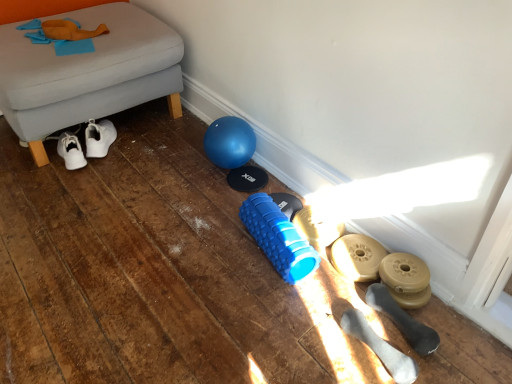
Image resolution: width=512 pixels, height=384 pixels. Describe the element at coordinates (317, 227) in the screenshot. I see `blue rubber shoe at center, placed as the 1th footwear when sorted from back to front` at that location.

The image size is (512, 384). Describe the element at coordinates (380, 347) in the screenshot. I see `white rubber dumbbells at lower right, the 1th footwear in the front-to-back sequence` at that location.

Identify the location of black rubber dumbbell at lower right, which is the second footwear in front-to-back order. Image resolution: width=512 pixels, height=384 pixels. (403, 320).

Identify the location of matte gold dumbbell at lower right, which appears as the third footwear when viewed from the back. This screenshot has width=512, height=384. (406, 279).

From their relative heights in the image, would you say beige rubber weight at lower right, which is the fourth footwear from front to back, is taller or shorter than blue rubber foam roller at center?

In the image, beige rubber weight at lower right, which is the fourth footwear from front to back, appears to be shorter than blue rubber foam roller at center.

From a real-world perspective, is beige rubber weight at lower right, the 2th footwear in the back-to-front sequence, physically above blue rubber foam roller at center?

Incorrect, from a real-world perspective, beige rubber weight at lower right, the 2th footwear in the back-to-front sequence, is lower than blue rubber foam roller at center.

From the image's perspective, is beige rubber weight at lower right, which is the fourth footwear from front to back, located above blue rubber foam roller at center?

Actually, beige rubber weight at lower right, which is the fourth footwear from front to back, appears below blue rubber foam roller at center in the image.

At what (x,y) coordinates should I click in order to perform the action: click on the 1st footwear behind the blue rubber foam roller at center, counting from the anchor's position. Please return your answer as a coordinate pair (x, y). The width and height of the screenshot is (512, 384). Looking at the image, I should click on (357, 257).

From the image's perspective, which is above, blue rubber foam roller at center or black rubber dumbbell at lower right, which is the second footwear in front-to-back order?

blue rubber foam roller at center appears higher in the image.

Is black rubber dumbbell at lower right, which is the second footwear in front-to-back order, inside blue rubber foam roller at center?

No, black rubber dumbbell at lower right, which is the second footwear in front-to-back order, is not inside blue rubber foam roller at center.

At what (x,y) coordinates should I click in order to perform the action: click on dumbbell lying behind the black rubber dumbbell at lower right, which is counted as the 4th footwear, starting from the back. Please return your answer as a coordinate pair (x, y). This screenshot has width=512, height=384. Looking at the image, I should click on (278, 238).

How different are the orientations of blue rubber foam roller at center and black rubber dumbbell at lower right, which is counted as the 4th footwear, starting from the back, in degrees?

blue rubber foam roller at center and black rubber dumbbell at lower right, which is counted as the 4th footwear, starting from the back, are facing 5.18 degrees away from each other.

Is gray fabric ottoman at lower left to the left or to the right of white rubber dumbbells at lower right, which is the 5th footwear from back to front, in the image?

Clearly, gray fabric ottoman at lower left is on the left of white rubber dumbbells at lower right, which is the 5th footwear from back to front, in the image.

Between gray fabric ottoman at lower left and white rubber dumbbells at lower right, the 1th footwear in the front-to-back sequence, which one is positioned in front?

white rubber dumbbells at lower right, the 1th footwear in the front-to-back sequence, is in front.

Would you say gray fabric ottoman at lower left is a long distance from white rubber dumbbells at lower right, which is the 5th footwear from back to front?

Yes, gray fabric ottoman at lower left is far from white rubber dumbbells at lower right, which is the 5th footwear from back to front.

Looking at this image, from a real-world perspective, is gray fabric ottoman at lower left located higher than white rubber dumbbells at lower right, the 1th footwear in the front-to-back sequence?

Indeed, from a real-world perspective, gray fabric ottoman at lower left stands above white rubber dumbbells at lower right, the 1th footwear in the front-to-back sequence.

Is point (28, 138) more distant than point (426, 299)?

Yes, point (28, 138) is behind point (426, 299).

Considering the positions of objects gray fabric ottoman at lower left and matte gold dumbbell at lower right, which appears as the third footwear when viewed from the back, in the image provided, who is in front, gray fabric ottoman at lower left or matte gold dumbbell at lower right, which appears as the third footwear when viewed from the back,?

matte gold dumbbell at lower right, which appears as the third footwear when viewed from the back, is closer to the camera.

Considering the relative sizes of gray fabric ottoman at lower left and matte gold dumbbell at lower right, positioned as the third footwear in front-to-back order, in the image provided, is gray fabric ottoman at lower left wider than matte gold dumbbell at lower right, positioned as the third footwear in front-to-back order,?

Correct, the width of gray fabric ottoman at lower left exceeds that of matte gold dumbbell at lower right, positioned as the third footwear in front-to-back order.

From the picture: Does gray fabric ottoman at lower left have a greater width compared to black rubber dumbbell at lower right, which is the second footwear in front-to-back order?

Yes, gray fabric ottoman at lower left is wider than black rubber dumbbell at lower right, which is the second footwear in front-to-back order.

Could you tell me if gray fabric ottoman at lower left is facing black rubber dumbbell at lower right, which is counted as the 4th footwear, starting from the back?

Yes, gray fabric ottoman at lower left is oriented towards black rubber dumbbell at lower right, which is counted as the 4th footwear, starting from the back.

Is point (102, 86) behind point (396, 324)?

Yes.

Is blue rubber shoe at center, the fifth footwear positioned from the front, looking in the opposite direction of blue rubber foam roller at center?

That's not correct — blue rubber shoe at center, the fifth footwear positioned from the front, is not looking away from blue rubber foam roller at center.

Can you confirm if blue rubber shoe at center, the fifth footwear positioned from the front, is thinner than blue rubber foam roller at center?

No, blue rubber shoe at center, the fifth footwear positioned from the front, is not thinner than blue rubber foam roller at center.

From a real-world perspective, which object rests below the other?

blue rubber shoe at center, the fifth footwear positioned from the front, is physically lower.

From a real-world perspective, relative to white rubber dumbbells at lower right, the 1th footwear in the front-to-back sequence, is blue rubber foam roller at center vertically above or below?

blue rubber foam roller at center is above white rubber dumbbells at lower right, the 1th footwear in the front-to-back sequence.

What's the angular difference between blue rubber foam roller at center and white rubber dumbbells at lower right, the 1th footwear in the front-to-back sequence,'s facing directions?

The facing directions of blue rubber foam roller at center and white rubber dumbbells at lower right, the 1th footwear in the front-to-back sequence, are 2.79 degrees apart.

Do you think blue rubber foam roller at center is within white rubber dumbbells at lower right, the 1th footwear in the front-to-back sequence, or outside of it?

blue rubber foam roller at center is located beyond the bounds of white rubber dumbbells at lower right, the 1th footwear in the front-to-back sequence.

At what (x,y) coordinates should I click in order to perform the action: click on dumbbell on the left of beige rubber weight at lower right, the 2th footwear in the back-to-front sequence. Please return your answer as a coordinate pair (x, y). Image resolution: width=512 pixels, height=384 pixels. Looking at the image, I should click on (278, 238).

Identify the location of the 4th footwear counting from the right side of the blue rubber foam roller at center. Image resolution: width=512 pixels, height=384 pixels. (403, 320).

Looking at the image, which one is located further to gray fabric ottoman at lower left, blue rubber foam roller at center or blue rubber shoe at center, placed as the 1th footwear when sorted from back to front?

blue rubber shoe at center, placed as the 1th footwear when sorted from back to front.

Estimate the real-world distances between objects in this image. Which object is further from matte gold dumbbell at lower right, which appears as the third footwear when viewed from the back, black rubber dumbbell at lower right, which is the second footwear in front-to-back order, or gray fabric ottoman at lower left?

gray fabric ottoman at lower left.

Looking at this image, which object lies nearer to the anchor point blue rubber foam roller at center, beige rubber weight at lower right, the 2th footwear in the back-to-front sequence, or blue rubber shoe at center, the fifth footwear positioned from the front?

Based on the image, blue rubber shoe at center, the fifth footwear positioned from the front, appears to be nearer to blue rubber foam roller at center.

From the image, which object appears to be farther from blue rubber shoe at center, placed as the 1th footwear when sorted from back to front, beige rubber weight at lower right, the 2th footwear in the back-to-front sequence, or white rubber dumbbells at lower right, the 1th footwear in the front-to-back sequence?

Among the two, white rubber dumbbells at lower right, the 1th footwear in the front-to-back sequence, is located further to blue rubber shoe at center, placed as the 1th footwear when sorted from back to front.

Considering their positions, is blue rubber foam roller at center positioned closer to blue rubber shoe at center, the fifth footwear positioned from the front, than beige rubber weight at lower right, the 2th footwear in the back-to-front sequence?

beige rubber weight at lower right, the 2th footwear in the back-to-front sequence, is positioned closer to the anchor blue rubber shoe at center, the fifth footwear positioned from the front.

Estimate the real-world distances between objects in this image. Which object is closer to blue rubber shoe at center, placed as the 1th footwear when sorted from back to front, white rubber dumbbells at lower right, the 1th footwear in the front-to-back sequence, or gray fabric ottoman at lower left?

Among the two, white rubber dumbbells at lower right, the 1th footwear in the front-to-back sequence, is located nearer to blue rubber shoe at center, placed as the 1th footwear when sorted from back to front.

Looking at the image, which one is located closer to white rubber dumbbells at lower right, which is the 5th footwear from back to front, black rubber dumbbell at lower right, which is the second footwear in front-to-back order, or blue rubber foam roller at center?

black rubber dumbbell at lower right, which is the second footwear in front-to-back order, is positioned closer to the anchor white rubber dumbbells at lower right, which is the 5th footwear from back to front.

Estimate the real-world distances between objects in this image. Which object is closer to black rubber dumbbell at lower right, which is the second footwear in front-to-back order, white rubber dumbbells at lower right, the 1th footwear in the front-to-back sequence, or beige rubber weight at lower right, which is the fourth footwear from front to back?

white rubber dumbbells at lower right, the 1th footwear in the front-to-back sequence, is positioned closer to the anchor black rubber dumbbell at lower right, which is the second footwear in front-to-back order.

Where is `dumbbell between gray fabric ottoman at lower left and white rubber dumbbells at lower right, the 1th footwear in the front-to-back sequence, in the horizontal direction`? dumbbell between gray fabric ottoman at lower left and white rubber dumbbells at lower right, the 1th footwear in the front-to-back sequence, in the horizontal direction is located at coordinates (278, 238).

What are the coordinates of `dumbbell located between gray fabric ottoman at lower left and beige rubber weight at lower right, the 2th footwear in the back-to-front sequence, in the left-right direction` in the screenshot? It's located at (278, 238).

I want to click on dumbbell between gray fabric ottoman at lower left and blue rubber shoe at center, placed as the 1th footwear when sorted from back to front, from left to right, so pos(278,238).

This screenshot has width=512, height=384. Find the location of `footwear positioned between black rubber dumbbell at lower right, which is the second footwear in front-to-back order, and beige rubber weight at lower right, which is the fourth footwear from front to back, from near to far`. footwear positioned between black rubber dumbbell at lower right, which is the second footwear in front-to-back order, and beige rubber weight at lower right, which is the fourth footwear from front to back, from near to far is located at coordinates (406, 279).